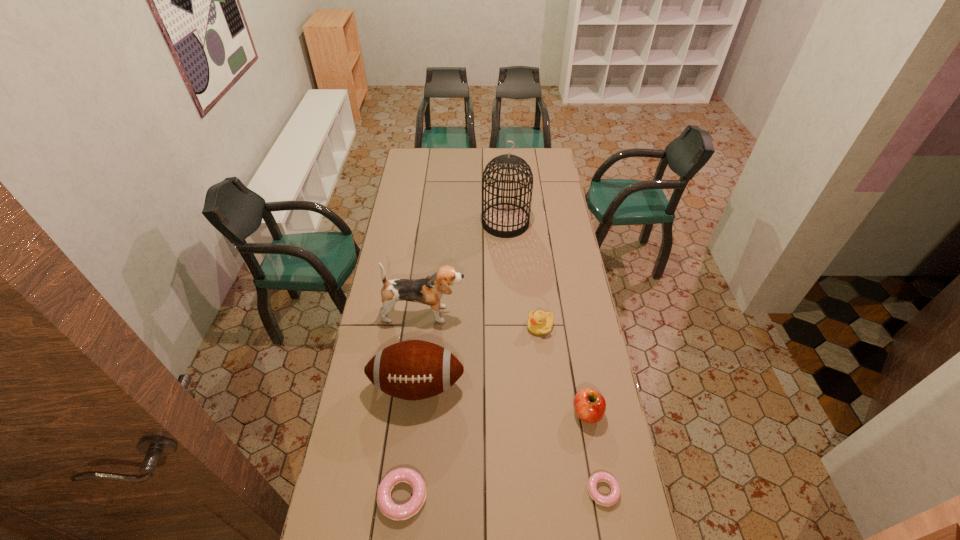
I want to click on vacant space at the right edge of the desktop, so click(x=546, y=238).

Where is `free space between the duckling and the fifth shortest object`? The width and height of the screenshot is (960, 540). free space between the duckling and the fifth shortest object is located at coordinates click(478, 356).

Find the location of `free space between the third shortest object and the fifth shortest object`. free space between the third shortest object and the fifth shortest object is located at coordinates (478, 356).

This screenshot has height=540, width=960. In order to click on free space between the sixth tallest object and the sixth shortest object in this screenshot , I will do `click(413, 405)`.

You are a GUI agent. You are given a task and a screenshot of the screen. Output one action in this format:
    pyautogui.click(x=<x>, y=<y>)
    Task: Click on the unoccupied area between the taller doughnut and the shortest object
    This screenshot has width=960, height=540.
    Given the screenshot: What is the action you would take?
    pyautogui.click(x=503, y=493)

Locate an element on the screen. This screenshot has width=960, height=540. empty space that is in between the football and the left doughnut is located at coordinates (410, 441).

At what (x,y) coordinates should I click in order to perform the action: click on free space between the apple and the football. Please return your answer as a coordinate pair (x, y). Looking at the image, I should click on (502, 399).

The width and height of the screenshot is (960, 540). Find the location of `free spot between the tallest object and the sixth shortest object`. free spot between the tallest object and the sixth shortest object is located at coordinates (465, 268).

Image resolution: width=960 pixels, height=540 pixels. Find the location of `free space between the right doughnut and the second tallest object`. free space between the right doughnut and the second tallest object is located at coordinates (514, 402).

At what (x,y) coordinates should I click in order to perform the action: click on empty location between the duckling and the puppy. Please return your answer as a coordinate pair (x, y). The image size is (960, 540). Looking at the image, I should click on (482, 320).